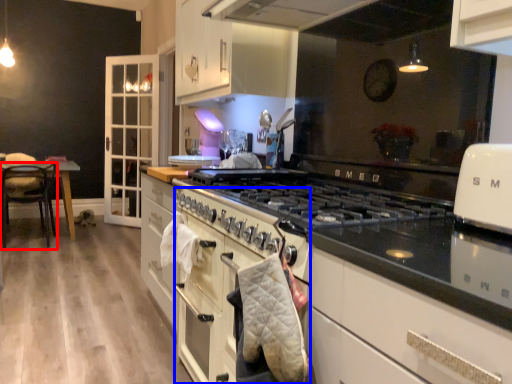
Question: Which of the following is the farthest to the observer, chair (highlighted by a red box) or oven (highlighted by a blue box)?

Choices:
 (A) chair
 (B) oven

Answer: (A)